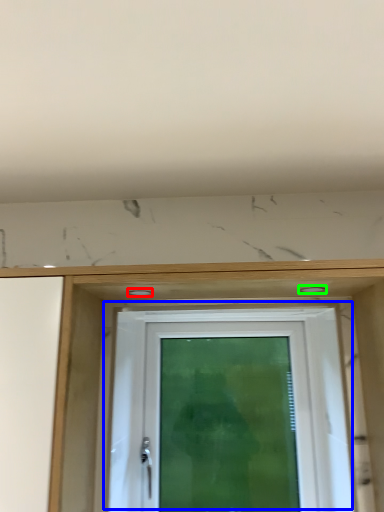
Question: Which object is the farthest from hole (highlighted by a red box)? Choose among these: door (highlighted by a blue box) or hole (highlighted by a green box).

Choices:
 (A) door
 (B) hole

Answer: (A)